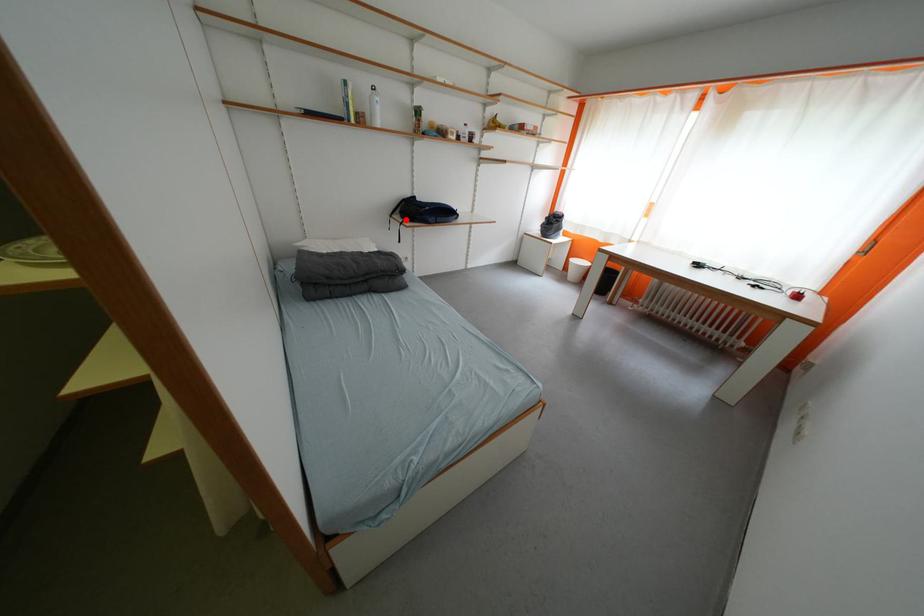
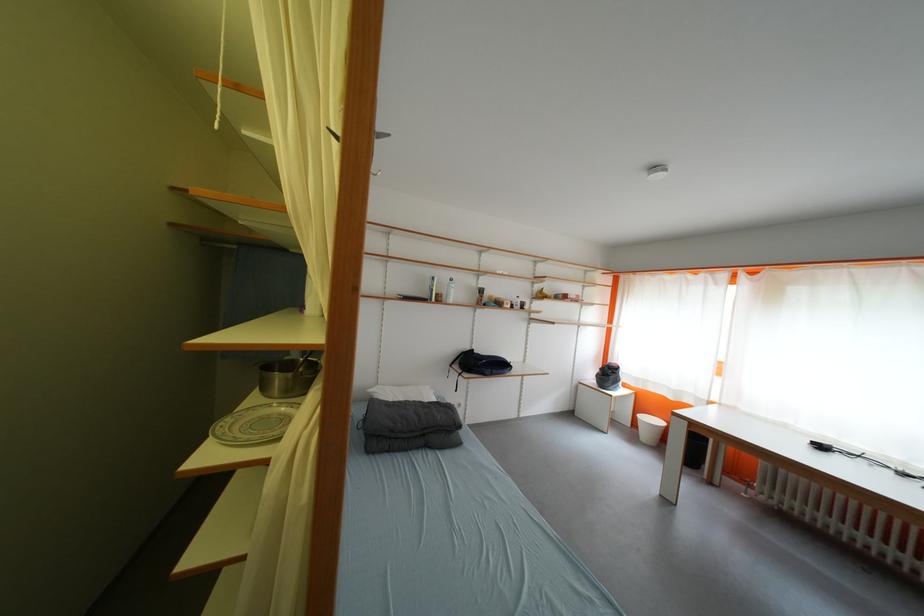
Question: I am providing you with two images of the same scene from different viewpoints. Given a red point in image1, look at the same physical point in image2. Is it:

Choices:
 (A) Closer to the viewpoint
 (B) Farther from the viewpoint

Answer: (B)